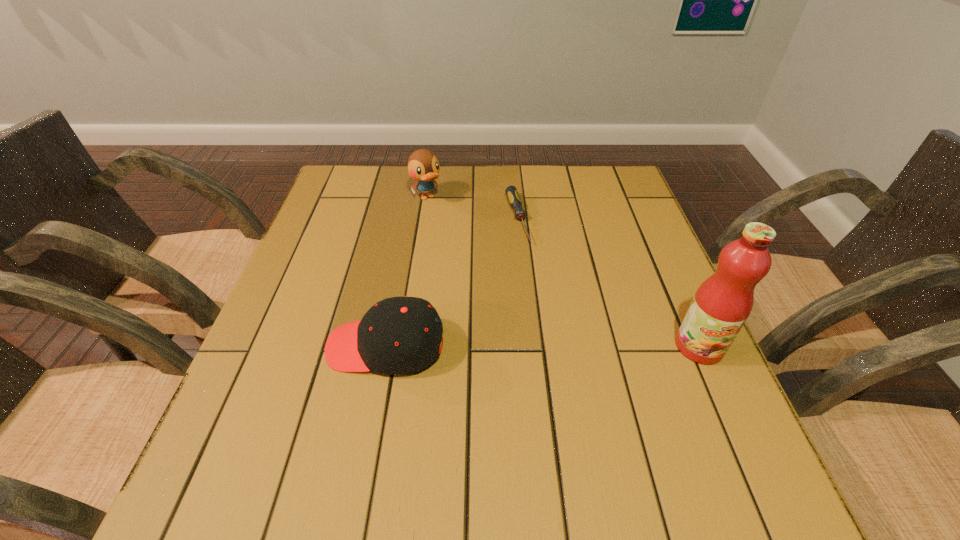
The height and width of the screenshot is (540, 960). Identify the location of vacant space located insert the second object from right to left into a screw head. (564, 360).

Locate an element on the screen. Image resolution: width=960 pixels, height=540 pixels. free space located 0.300m on the front-facing side of the second tallest object is located at coordinates click(x=486, y=270).

At what (x,y) coordinates should I click in order to perform the action: click on free space located on the front-facing side of the second tallest object. Please return your answer as a coordinate pair (x, y). This screenshot has width=960, height=540. Looking at the image, I should click on (443, 218).

You are a GUI agent. You are given a task and a screenshot of the screen. Output one action in this format:
    pyautogui.click(x=<x>, y=<y>)
    Task: Click on the free spot located on the front-facing side of the second tallest object
    Image resolution: width=960 pixels, height=540 pixels.
    Given the screenshot: What is the action you would take?
    pyautogui.click(x=443, y=218)

The height and width of the screenshot is (540, 960). I want to click on screwdriver at the far edge, so click(x=512, y=194).

Locate an element on the screen. duck at the far edge is located at coordinates (423, 166).

At what (x,y) coordinates should I click in order to perform the action: click on object situated at the left edge. Please return your answer as a coordinate pair (x, y). The width and height of the screenshot is (960, 540). Looking at the image, I should click on (399, 335).

Where is `object situated at the right edge`? This screenshot has width=960, height=540. object situated at the right edge is located at coordinates (721, 305).

Locate an element on the screen. free spot at the far edge of the desktop is located at coordinates (579, 210).

You are a GUI agent. You are given a task and a screenshot of the screen. Output one action in this format:
    pyautogui.click(x=<x>, y=<y>)
    Task: Click on the vacant region at the near edge of the desktop
    
    Given the screenshot: What is the action you would take?
    pyautogui.click(x=479, y=406)